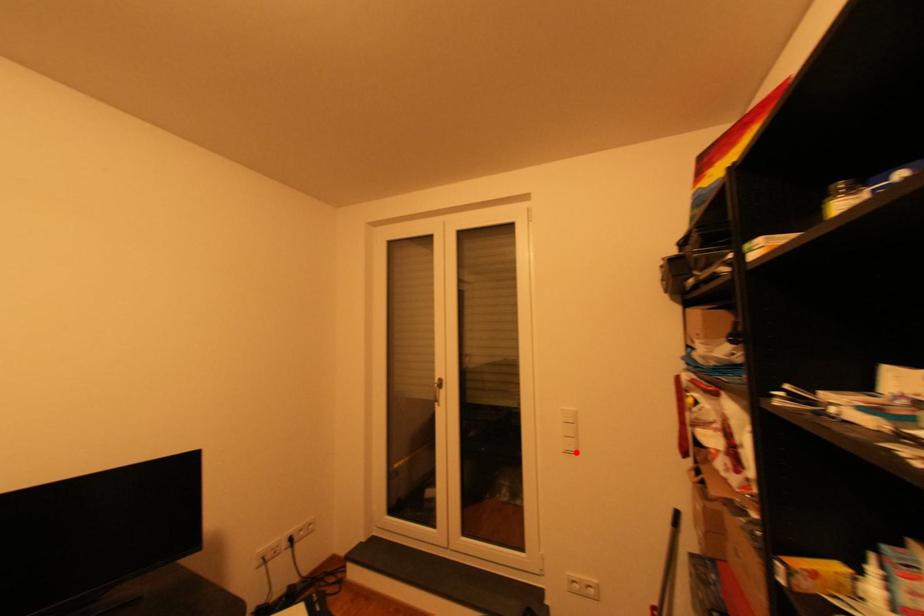
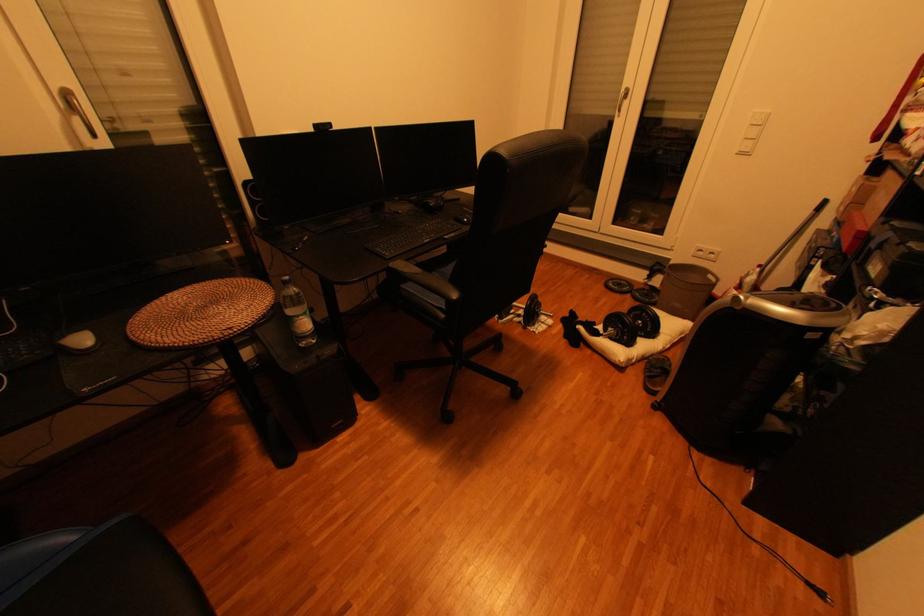
Question: I am providing you with two images of the same scene from different viewpoints. A red point is marked on the first image. Can you still see the location of the red point in image 2?

Choices:
 (A) Yes
 (B) No

Answer: (A)